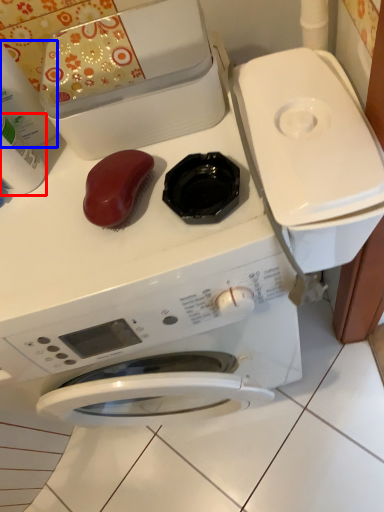
Question: Which of the following is the farthest to the observer, cleaning product (highlighted by a red box) or cleaning product (highlighted by a blue box)?

Choices:
 (A) cleaning product
 (B) cleaning product

Answer: (A)